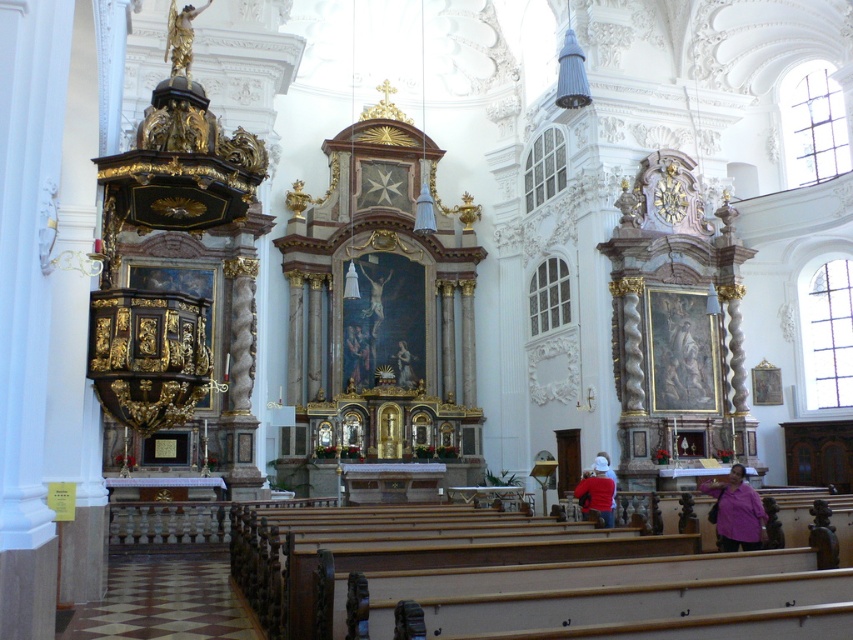
Who is positioned more to the left, red matte jacket at center or gold ornate statue at center?

gold ornate statue at center

Is red matte jacket at center behind gold ornate statue at center?

That is False.

Which is behind, point (599, 486) or point (405, 387)?

Positioned behind is point (405, 387).

Where is `red matte jacket at center`? This screenshot has width=853, height=640. red matte jacket at center is located at coordinates (596, 492).

Is point (682, 200) more distant than point (397, 353)?

No.

Based on the photo, can you confirm if gold textured clock at upper right is thinner than gold ornate statue at center?

Incorrect, gold textured clock at upper right's width is not less than gold ornate statue at center's.

In order to click on gold textured clock at upper right in this screenshot , I will do `click(669, 196)`.

Is point (762, 529) closer to camera compared to point (399, 378)?

Yes.

Who is lower down, purple fabric at lower right or gold ornate statue at center?

purple fabric at lower right is below.

Is point (762, 538) farther from viewer compared to point (399, 365)?

No, it is in front of (399, 365).

At what (x,y) coordinates should I click in order to perform the action: click on purple fabric at lower right. Please return your answer as a coordinate pair (x, y). Looking at the image, I should click on (735, 512).